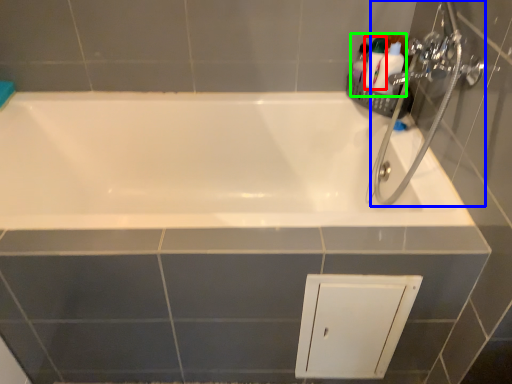
Question: Which object is positioned closest to toiletry (highlighted by a red box)? Select from plumbing fixture (highlighted by a blue box) and toiletry (highlighted by a green box).

Choices:
 (A) plumbing fixture
 (B) toiletry

Answer: (B)